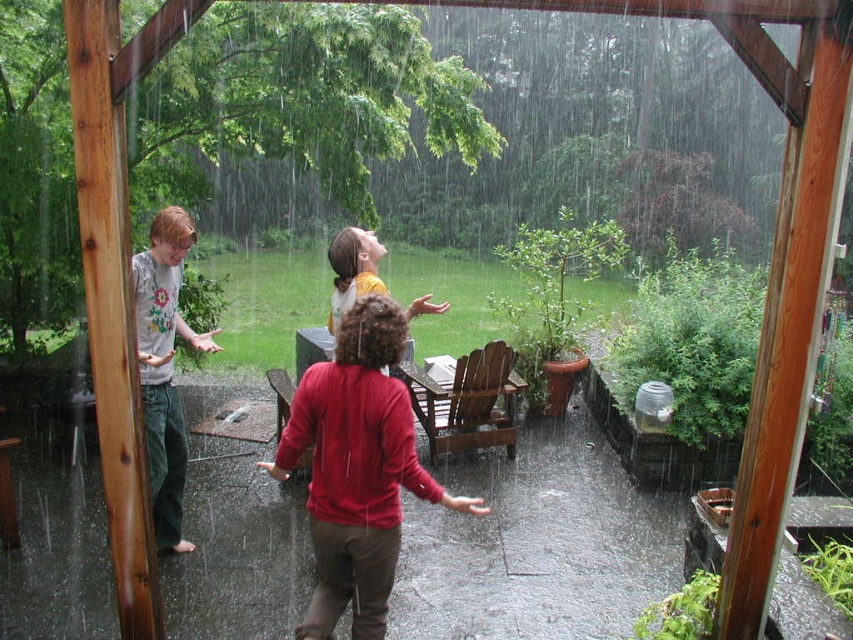
Question: Does matte red sweater at center appear over gray cotton shirt at left?

Choices:
 (A) no
 (B) yes

Answer: (A)

Question: Can you confirm if matte red sweater at center is positioned to the left of gray cotton shirt at left?

Choices:
 (A) no
 (B) yes

Answer: (A)

Question: From the image, what is the correct spatial relationship of matte red sweater at center in relation to gray cotton shirt at left?

Choices:
 (A) left
 (B) right

Answer: (B)

Question: Which point is farther to the camera?

Choices:
 (A) [479, 497]
 (B) [166, 397]

Answer: (A)

Question: Which point is closer to the camera?

Choices:
 (A) matte red sweater at center
 (B) gray cotton shirt at left

Answer: (A)

Question: Which point appears farthest from the camera in this image?

Choices:
 (A) (137, 349)
 (B) (367, 536)

Answer: (A)